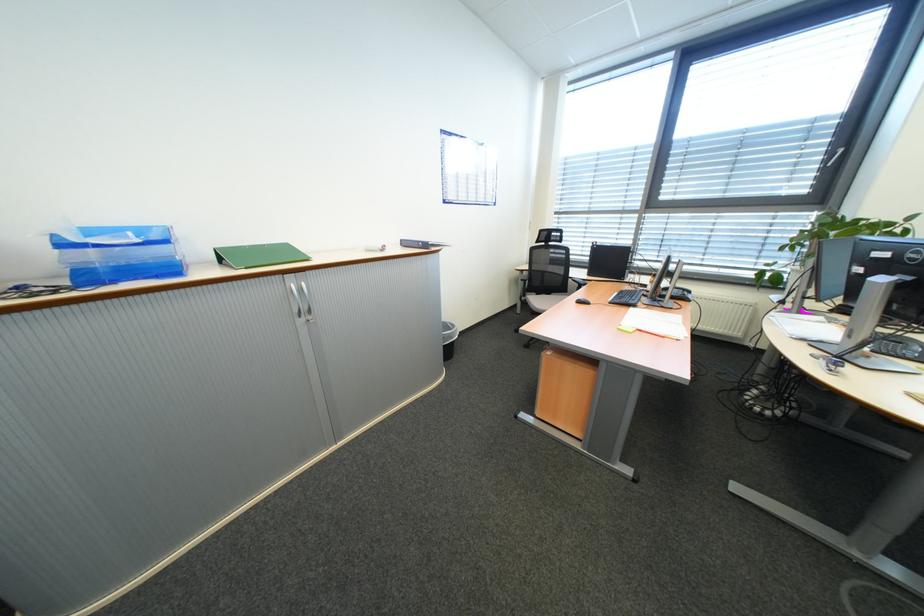
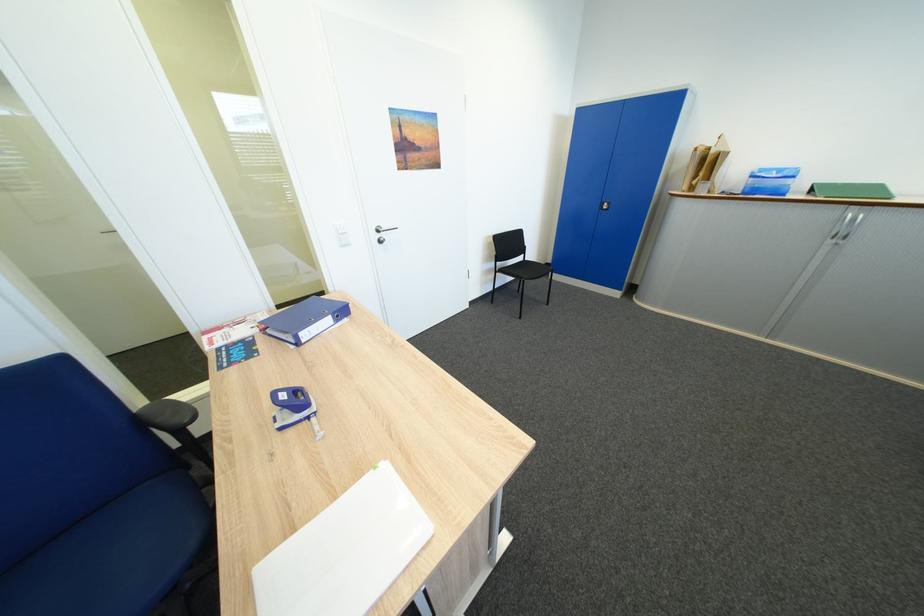
Find the pixel in the second image that matches [231,260] in the first image.

(822, 192)